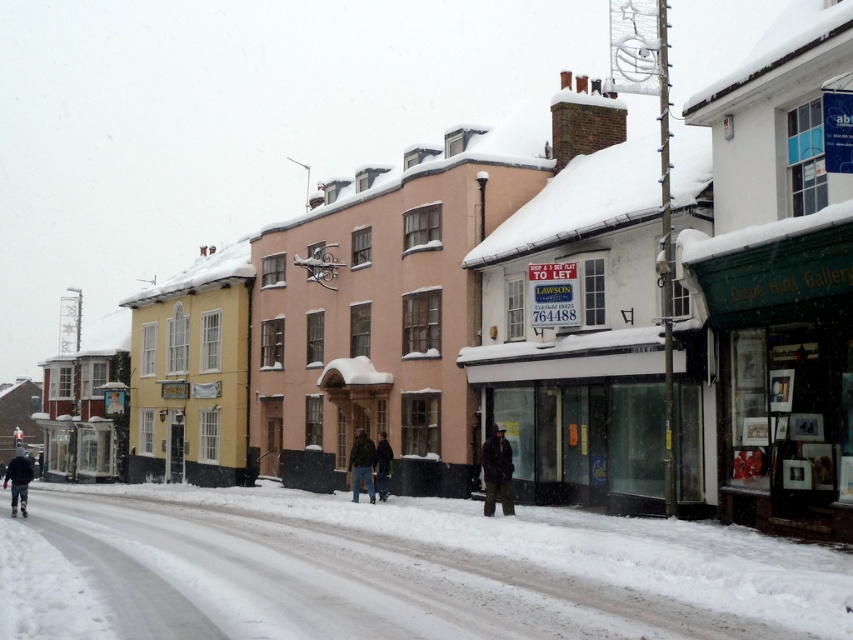
Looking at this image, does green matte signboard at center have a greater height compared to dark green jacket at center?

Correct, green matte signboard at center is much taller as dark green jacket at center.

Does green matte signboard at center appear under dark green jacket at center?

Incorrect, green matte signboard at center is not positioned below dark green jacket at center.

Where is `green matte signboard at center`? green matte signboard at center is located at coordinates (782, 371).

The height and width of the screenshot is (640, 853). What do you see at coordinates (782, 371) in the screenshot?
I see `green matte signboard at center` at bounding box center [782, 371].

Between green matte signboard at center and green fuzzy jacket at center, which one is positioned higher?

green matte signboard at center is above.

Find the location of a particular element. The height and width of the screenshot is (640, 853). green matte signboard at center is located at coordinates (782, 371).

Is point (361, 440) positioned behind point (19, 464)?

Yes, point (361, 440) is behind point (19, 464).

Which is below, green fuzzy jacket at center or dark gray jacket at lower left?

dark gray jacket at lower left is lower down.

You are a GUI agent. You are given a task and a screenshot of the screen. Output one action in this format:
    pyautogui.click(x=<x>, y=<y>)
    Task: Click on the green fuzzy jacket at center
    The image size is (853, 640).
    Given the screenshot: What is the action you would take?
    pyautogui.click(x=361, y=464)